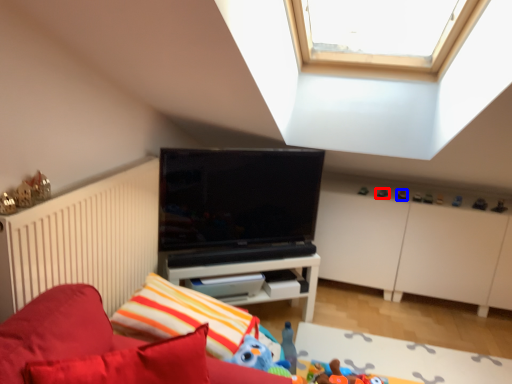
Question: Which point is closer to the camera, toy (highlighted by a red box) or toy (highlighted by a blue box)?

Choices:
 (A) toy
 (B) toy

Answer: (B)